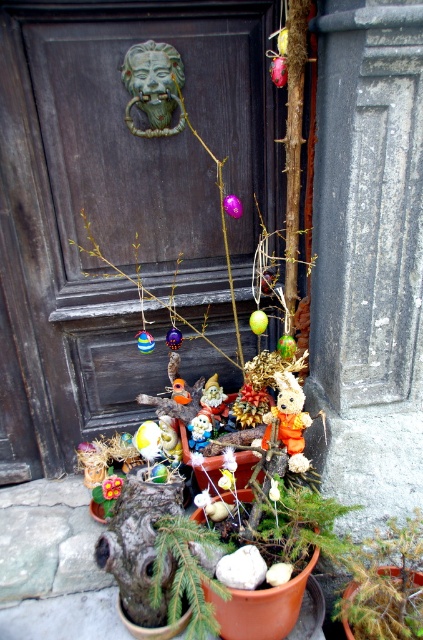
Question: Which point is farther from the camera taking this photo?

Choices:
 (A) (214, 582)
 (B) (290, 396)
 (C) (197, 186)

Answer: (C)

Question: Which object is closer to the camera taking this photo?

Choices:
 (A) dark wood door at center
 (B) orange fabric rabbit at center
 (C) green matte plant at center

Answer: (C)

Question: Among these objects, which one is nearest to the camera?

Choices:
 (A) green matte plant at center
 (B) green matte lion head at upper center
 (C) dark wood door at center

Answer: (A)

Question: Observing the image, what is the correct spatial positioning of dark wood door at center in reference to orange fabric rabbit at center?

Choices:
 (A) above
 (B) below

Answer: (A)

Question: Can you confirm if green matte plant at center is thinner than orange fabric rabbit at center?

Choices:
 (A) no
 (B) yes

Answer: (A)

Question: Does green matte lion head at upper center have a smaller size compared to orange fabric rabbit at center?

Choices:
 (A) no
 (B) yes

Answer: (B)